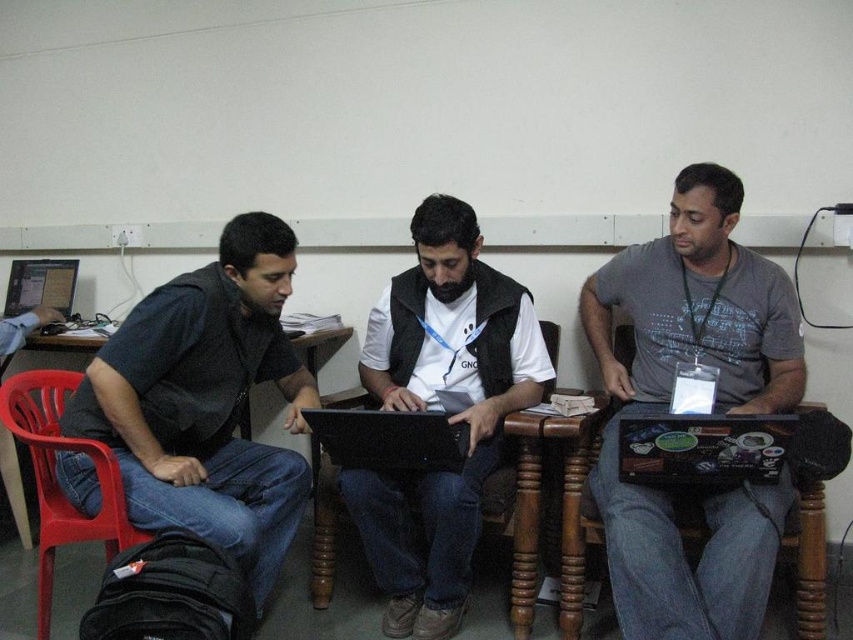
What are the coordinates of the matte black laptop at center?

The coordinates of the matte black laptop at center are at point (440,406).

You are trying to sit down in the plastic chair at left without touching the matte black laptop at left. Is this possible based on their current positions?

The plastic chair at left is positioned on the right side of the matte black laptop at left, so there is space between them. Therefore, you can sit down in the plastic chair at left without touching the matte black laptop at left.

You are a person who is 1.7 meters tall and want to sit on the plastic chair at left to use the matte black laptop at left. Considering the height of the chair, will your feet touch the ground?

The plastic chair at left is much taller than the matte black laptop at left. Since the chair is significantly taller, your feet may not touch the ground when sitting on it, which might be uncomfortable.